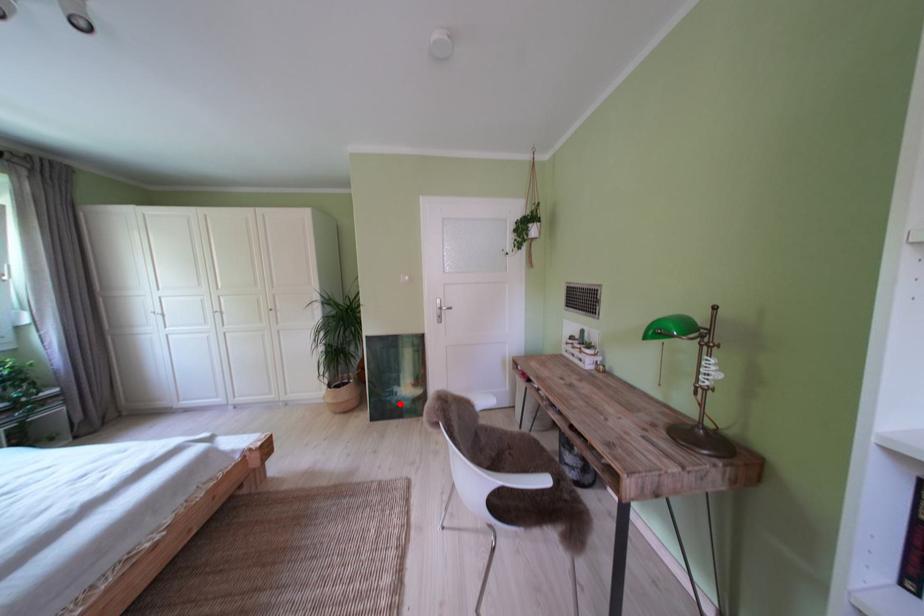
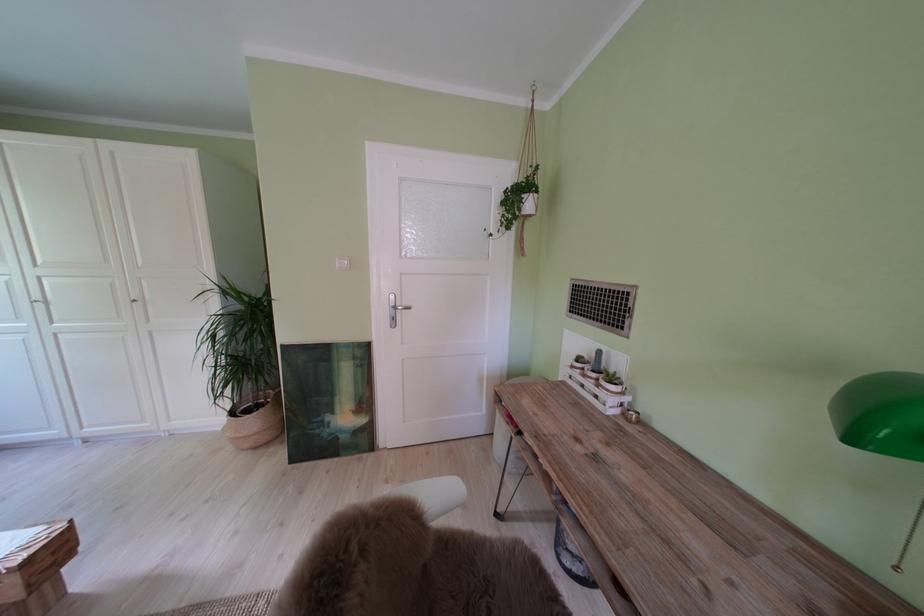
Question: I am providing you with two images of the same scene from different viewpoints. In image1, a red point is highlighted. Considering the same 3D point in image2, which of the following is correct?

Choices:
 (A) It is closer
 (B) It is farther

Answer: (A)